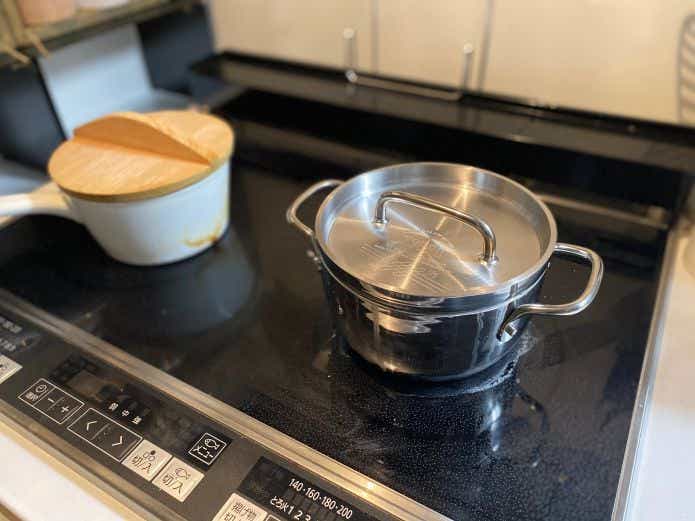
The image size is (695, 521). In order to click on white kitchen wall in this screenshot , I will do `click(575, 47)`.